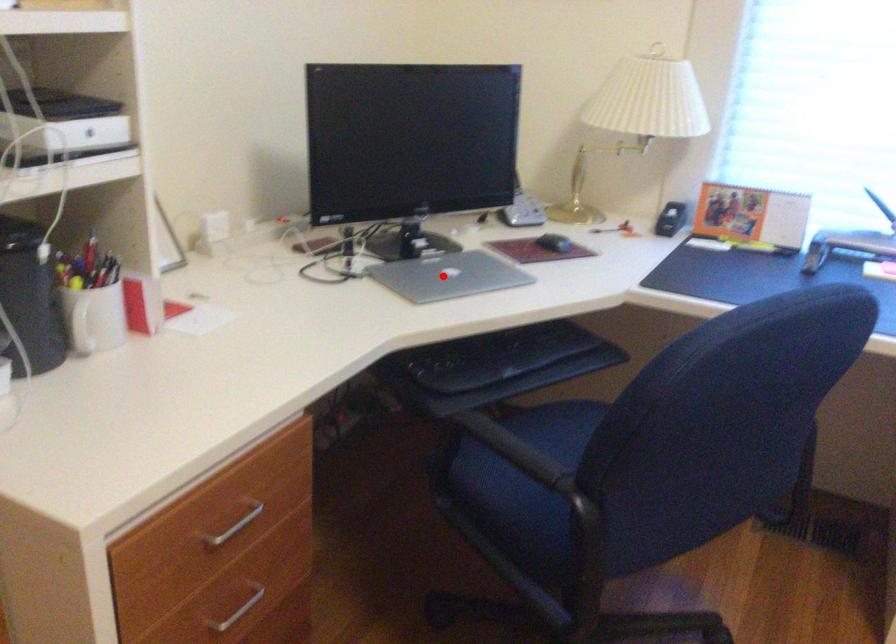
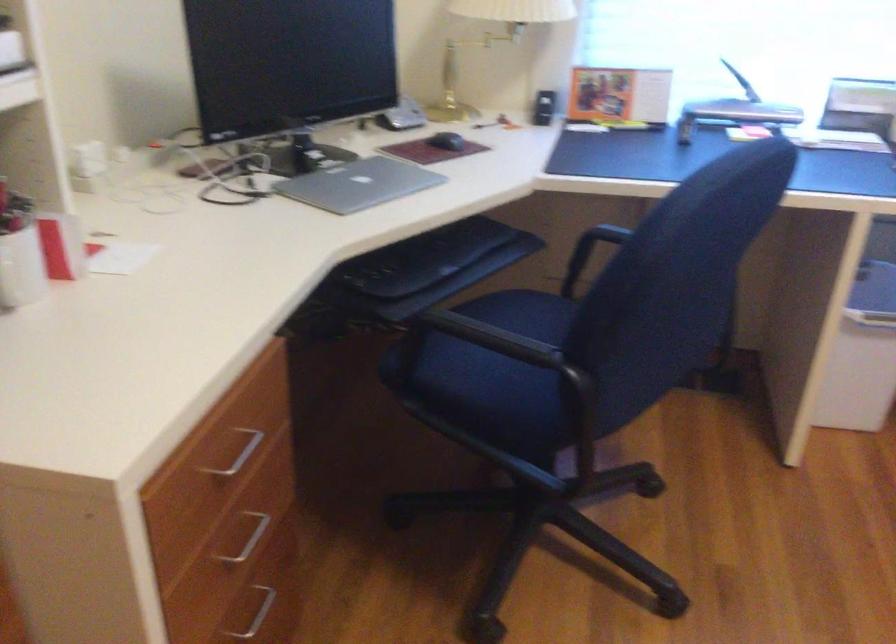
Find the pixel in the second image that matches the highlighted location in the first image.

(358, 184)